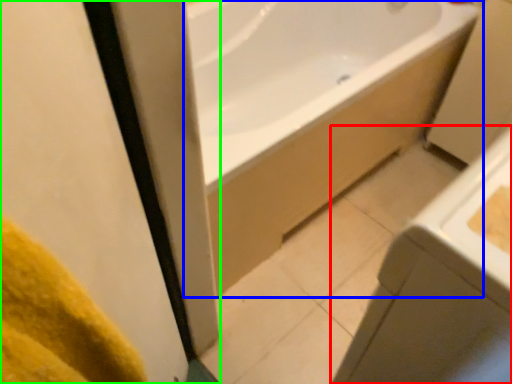
Question: Which object is positioned closest to sink (highlighted by a red box)? Select from bathtub (highlighted by a blue box) and screen door (highlighted by a green box).

Choices:
 (A) bathtub
 (B) screen door

Answer: (B)